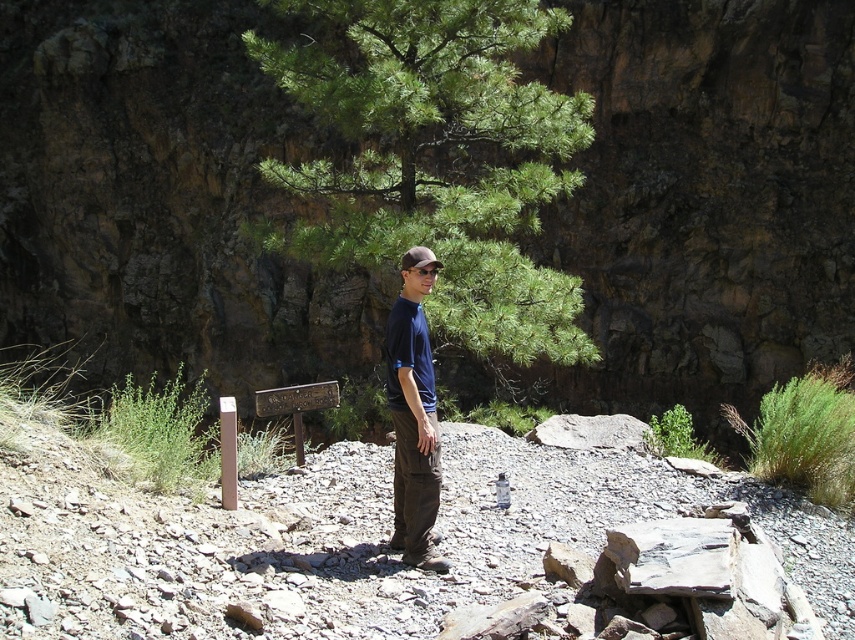
You are a hiker who wants to take a photo of the green leafy tree at center from a distance of 10 meters. Based on the scene, can you position yourself to take the photo while staying on the rocky terrain? Explain your reasoning.

The green leafy tree at center and viewer are 10.86 meters apart. Since 10.86 meters is slightly more than 10 meters, you can move a little closer to the tree while staying on the rocky terrain to achieve the desired distance for the photo.